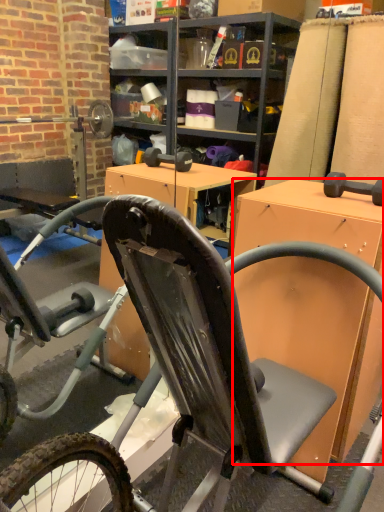
Question: Where is desk (annotated by the red box) located in relation to bicycle in the image?

Choices:
 (A) left
 (B) right

Answer: (B)